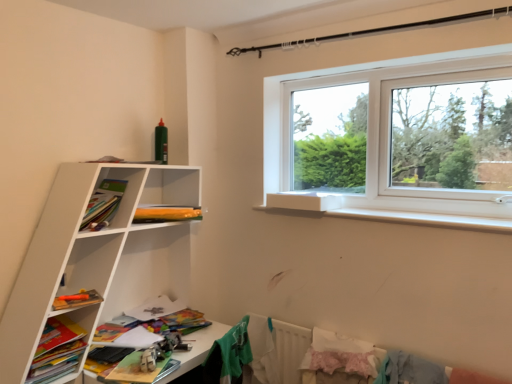
What are the coordinates of `light blue fabric at lower right, marked as the third clothing in a left-to-right arrangement` in the screenshot? It's located at (409, 370).

In order to face light blue fabric at lower right, marked as the third clothing in a left-to-right arrangement, should I rotate leftwards or rightwards?

Turn right approximately 19.965 degrees to face it.

What do you see at coordinates (197, 348) in the screenshot? This screenshot has width=512, height=384. I see `wooden toy car at lower left` at bounding box center [197, 348].

Identify the location of black metal clothesline at upper center. (372, 31).

This screenshot has width=512, height=384. What do you see at coordinates (228, 356) in the screenshot?
I see `green fabric shirt at lower center, which ranks as the third clothing in right-to-left order` at bounding box center [228, 356].

Locate an element on the screen. Image resolution: width=512 pixels, height=384 pixels. light blue fabric at lower right, marked as the third clothing in a left-to-right arrangement is located at coordinates (409, 370).

Can you confirm if wooden toy car at lower left is shorter than light blue fabric at lower right, marked as the third clothing in a left-to-right arrangement?

Correct, wooden toy car at lower left is not as tall as light blue fabric at lower right, marked as the third clothing in a left-to-right arrangement.

Which is nearer, (178, 352) or (393, 355)?

Point (178, 352) is positioned farther from the camera compared to point (393, 355).

Is wooden toy car at lower left bigger or smaller than light blue fabric at lower right, marked as the third clothing in a left-to-right arrangement?

wooden toy car at lower left is bigger than light blue fabric at lower right, marked as the third clothing in a left-to-right arrangement.

Is orange matte book at lower left, the first book from the bottom, with white matte bookshelf at lower left, the first shelf from the bottom?

No, orange matte book at lower left, the first book from the bottom, is not next to white matte bookshelf at lower left, the first shelf from the bottom.

Based on the photo, from the image's perspective, is orange matte book at lower left, which appears as the second book when viewed from the top, located beneath white matte bookshelf at lower left, the first shelf from the bottom?

No, from the image's perspective, orange matte book at lower left, which appears as the second book when viewed from the top, is not below white matte bookshelf at lower left, the first shelf from the bottom.

This screenshot has height=384, width=512. In order to click on book that is the 1st object located behind the white matte bookshelf at lower left, the first shelf from the bottom in this screenshot , I will do `click(77, 300)`.

Looking at this image, is the depth of orange matte book at lower left, the first book from the bottom, less than that of white matte bookshelf at lower left, marked as the 2th shelf in a top-to-bottom arrangement?

No, it is not.

In terms of width, does black metal clothesline at upper center look wider or thinner when compared to orange matte book at lower left, the first book from the bottom?

In the image, black metal clothesline at upper center appears to be more narrow than orange matte book at lower left, the first book from the bottom.

From a real-world perspective, who is located lower, black metal clothesline at upper center or orange matte book at lower left, the first book from the bottom?

Answer: orange matte book at lower left, the first book from the bottom, from a real-world perspective.

Based on their sizes in the image, would you say black metal clothesline at upper center is bigger or smaller than orange matte book at lower left, acting as the first book starting from the front?

In the image, black metal clothesline at upper center appears to be larger than orange matte book at lower left, acting as the first book starting from the front.

At what (x,y) coordinates should I click in order to perform the action: click on the 1st shelf counting from the left side of the black metal clothesline at upper center. Please return your answer as a coordinate pair (x, y). This screenshot has height=384, width=512. Looking at the image, I should click on 97,254.

How different are the orientations of black metal clothesline at upper center and white matte shelf at left, which appears as the second shelf when ordered from the bottom, in degrees?

The angular difference between black metal clothesline at upper center and white matte shelf at left, which appears as the second shelf when ordered from the bottom, is 90 degrees.

From the image's perspective, between black metal clothesline at upper center and white matte shelf at left, which appears as the second shelf when ordered from the bottom, which one is located above?

black metal clothesline at upper center is shown above in the image.

Considering the positions of objects black metal clothesline at upper center and white matte shelf at left, the 1th shelf viewed from the top, in the image provided, who is more to the left, black metal clothesline at upper center or white matte shelf at left, the 1th shelf viewed from the top,?

white matte shelf at left, the 1th shelf viewed from the top, is more to the left.

Which object is more forward, matte orange pencil case at upper left, which is the 1th book from back to front, or orange matte book at lower left, which appears as the 2th book when viewed from the right?

orange matte book at lower left, which appears as the 2th book when viewed from the right, is more forward.

From the picture: Considering the relative sizes of matte orange pencil case at upper left, the 2th book in the bottom-to-top sequence, and orange matte book at lower left, which is the 2th book from back to front, in the image provided, is matte orange pencil case at upper left, the 2th book in the bottom-to-top sequence, bigger than orange matte book at lower left, which is the 2th book from back to front,?

Correct, matte orange pencil case at upper left, the 2th book in the bottom-to-top sequence, is larger in size than orange matte book at lower left, which is the 2th book from back to front.

Could you tell me if matte orange pencil case at upper left, which appears as the second book when viewed from the left, is facing orange matte book at lower left, which is the 2th book from back to front?

No.

Considering the relative positions of matte orange pencil case at upper left, which appears as the second book when viewed from the left, and orange matte book at lower left, which is the 2th book from back to front, in the image provided, is matte orange pencil case at upper left, which appears as the second book when viewed from the left, to the left of orange matte book at lower left, which is the 2th book from back to front, from the viewer's perspective?

Incorrect, matte orange pencil case at upper left, which appears as the second book when viewed from the left, is not on the left side of orange matte book at lower left, which is the 2th book from back to front.

From the picture: Which object is wider, white matte bookshelf at lower left, marked as the 2th shelf in a top-to-bottom arrangement, or fluffy pink fabric at lower right, the 2th clothing positioned from the left?

Wider between the two is white matte bookshelf at lower left, marked as the 2th shelf in a top-to-bottom arrangement.

How much distance is there between white matte bookshelf at lower left, marked as the 2th shelf in a top-to-bottom arrangement, and fluffy pink fabric at lower right, which ranks as the 2th clothing in right-to-left order?

A distance of 3.97 feet exists between white matte bookshelf at lower left, marked as the 2th shelf in a top-to-bottom arrangement, and fluffy pink fabric at lower right, which ranks as the 2th clothing in right-to-left order.

The width and height of the screenshot is (512, 384). I want to click on the 2nd clothing counting from the right side of the white matte bookshelf at lower left, marked as the 2th shelf in a top-to-bottom arrangement, so click(x=339, y=355).

Is white matte bookshelf at lower left, marked as the 2th shelf in a top-to-bottom arrangement, spatially inside fluffy pink fabric at lower right, which ranks as the 2th clothing in right-to-left order, or outside of it?

white matte bookshelf at lower left, marked as the 2th shelf in a top-to-bottom arrangement, is outside fluffy pink fabric at lower right, which ranks as the 2th clothing in right-to-left order.

Measure the distance from light blue fabric at lower right, which ranks as the first clothing in right-to-left order, to matte orange pencil case at upper left, which is the 2th book in front-to-back order.

light blue fabric at lower right, which ranks as the first clothing in right-to-left order, is 1.29 meters away from matte orange pencil case at upper left, which is the 2th book in front-to-back order.

Is light blue fabric at lower right, marked as the third clothing in a left-to-right arrangement, next to matte orange pencil case at upper left, which appears as the second book when viewed from the left?

No, light blue fabric at lower right, marked as the third clothing in a left-to-right arrangement, is not beside matte orange pencil case at upper left, which appears as the second book when viewed from the left.

Would you say light blue fabric at lower right, marked as the third clothing in a left-to-right arrangement, is outside matte orange pencil case at upper left, which is the 2th book in front-to-back order?

Yes.

Is light blue fabric at lower right, which ranks as the first clothing in right-to-left order, oriented away from matte orange pencil case at upper left, which is the 2th book in front-to-back order?

No, light blue fabric at lower right, which ranks as the first clothing in right-to-left order, is not facing the opposite direction of matte orange pencil case at upper left, which is the 2th book in front-to-back order.

Image resolution: width=512 pixels, height=384 pixels. Identify the location of table above the light blue fabric at lower right, marked as the third clothing in a left-to-right arrangement (from the image's perspective). (197, 348).

Starting from the orange matte book at lower left, the first book from the bottom, which shelf is the 1st one in front? Please provide its 2D coordinates.

[(57, 351)]

From the image, which object appears to be farther from orange matte book at lower left, marked as the 1th book in a left-to-right arrangement, wooden toy car at lower left or white matte bookshelf at lower left, marked as the 2th shelf in a top-to-bottom arrangement?

wooden toy car at lower left is further to orange matte book at lower left, marked as the 1th book in a left-to-right arrangement.

When comparing their distances from white matte bookshelf at lower left, marked as the 2th shelf in a top-to-bottom arrangement, does black metal clothesline at upper center or orange matte book at lower left, which is the 2th book from back to front, seem further?

Among the two, black metal clothesline at upper center is located further to white matte bookshelf at lower left, marked as the 2th shelf in a top-to-bottom arrangement.

Considering their positions, is fluffy pink fabric at lower right, the 2th clothing positioned from the left, positioned closer to orange matte book at lower left, which appears as the 2th book when viewed from the right, than matte orange pencil case at upper left, which is the first book in right-to-left order?

Among the two, matte orange pencil case at upper left, which is the first book in right-to-left order, is located nearer to orange matte book at lower left, which appears as the 2th book when viewed from the right.

When comparing their distances from black metal clothesline at upper center, does orange matte book at lower left, the first book from the bottom, or light blue fabric at lower right, which ranks as the first clothing in right-to-left order, seem closer?

light blue fabric at lower right, which ranks as the first clothing in right-to-left order, is closer to black metal clothesline at upper center.

When comparing their distances from black metal clothesline at upper center, does orange matte book at lower left, which appears as the 2th book when viewed from the right, or white matte bookshelf at lower left, marked as the 2th shelf in a top-to-bottom arrangement, seem further?

Among the two, white matte bookshelf at lower left, marked as the 2th shelf in a top-to-bottom arrangement, is located further to black metal clothesline at upper center.

Based on their spatial positions, is light blue fabric at lower right, marked as the third clothing in a left-to-right arrangement, or matte orange pencil case at upper left, which appears as the second book when viewed from the left, closer to green fabric shirt at lower center, which is the first clothing from left to right?

Among the two, matte orange pencil case at upper left, which appears as the second book when viewed from the left, is located nearer to green fabric shirt at lower center, which is the first clothing from left to right.

Considering their positions, is orange matte book at lower left, which appears as the 2th book when viewed from the right, positioned further to fluffy pink fabric at lower right, which ranks as the 2th clothing in right-to-left order, than light blue fabric at lower right, which ranks as the first clothing in right-to-left order?

Among the two, orange matte book at lower left, which appears as the 2th book when viewed from the right, is located further to fluffy pink fabric at lower right, which ranks as the 2th clothing in right-to-left order.

Based on their spatial positions, is fluffy pink fabric at lower right, which ranks as the 2th clothing in right-to-left order, or white matte shelf at left, which appears as the second shelf when ordered from the bottom, closer to light blue fabric at lower right, marked as the third clothing in a left-to-right arrangement?

→ fluffy pink fabric at lower right, which ranks as the 2th clothing in right-to-left order, lies closer to light blue fabric at lower right, marked as the third clothing in a left-to-right arrangement, than the other object.

Image resolution: width=512 pixels, height=384 pixels. In order to click on book that lies between black metal clothesline at upper center and orange matte book at lower left, acting as the first book starting from the front, from top to bottom in this screenshot , I will do `click(166, 213)`.

Image resolution: width=512 pixels, height=384 pixels. What are the coordinates of `shelf between white matte shelf at left, which appears as the second shelf when ordered from the bottom, and orange matte book at lower left, acting as the first book starting from the front, along the z-axis` in the screenshot? It's located at point(57,351).

Find the location of a particular element. This screenshot has height=384, width=512. table situated between white matte bookshelf at lower left, marked as the 2th shelf in a top-to-bottom arrangement, and green fabric shirt at lower center, which ranks as the third clothing in right-to-left order, from left to right is located at coordinates (197, 348).

Find the location of a particular element. book located between wooden toy car at lower left and fluffy pink fabric at lower right, the 2th clothing positioned from the left, in the left-right direction is located at coordinates (166, 213).